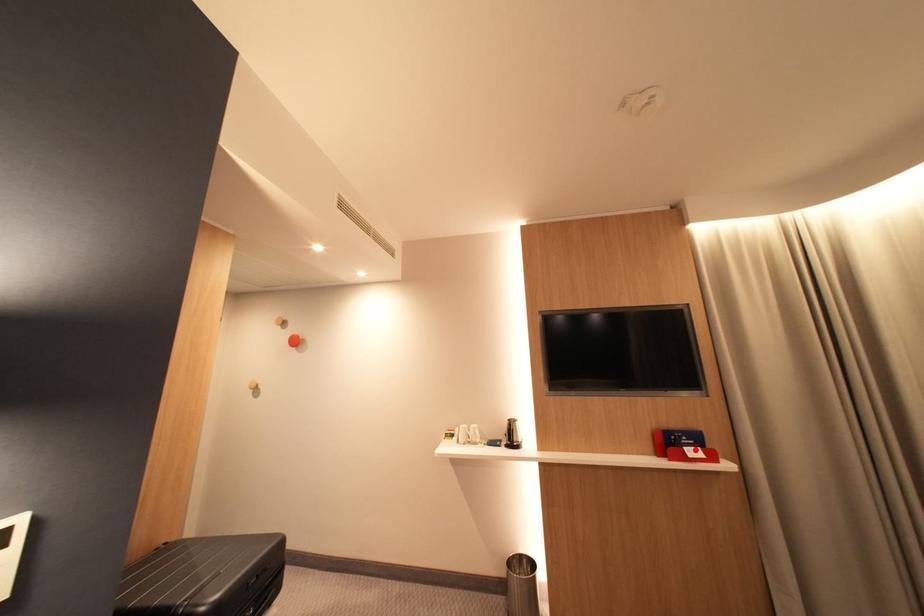
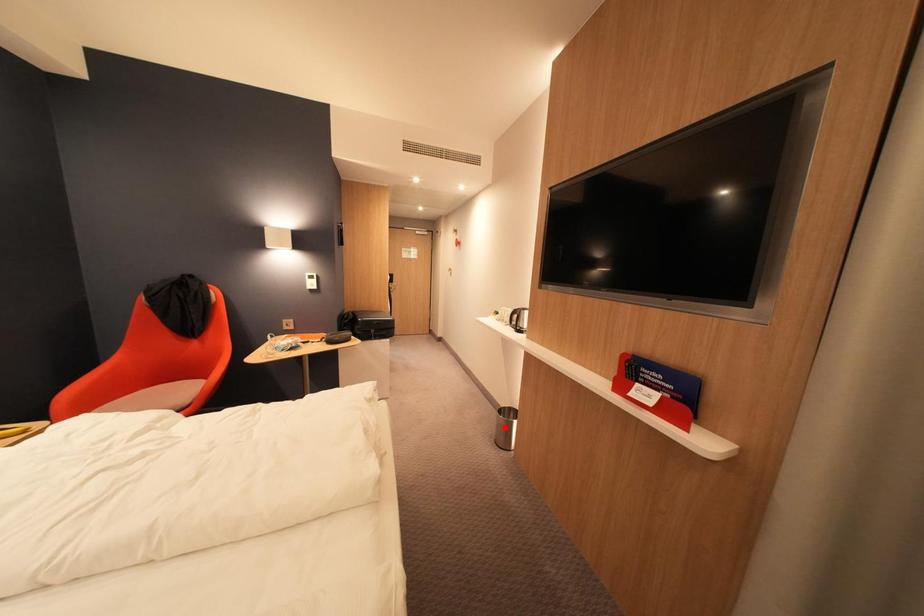
I am providing you with two images of the same scene from different viewpoints. A red point is marked on the first image and another point is marked on the second image. Do the highlighted points in image1 and image2 indicate the same real-world spot?

No